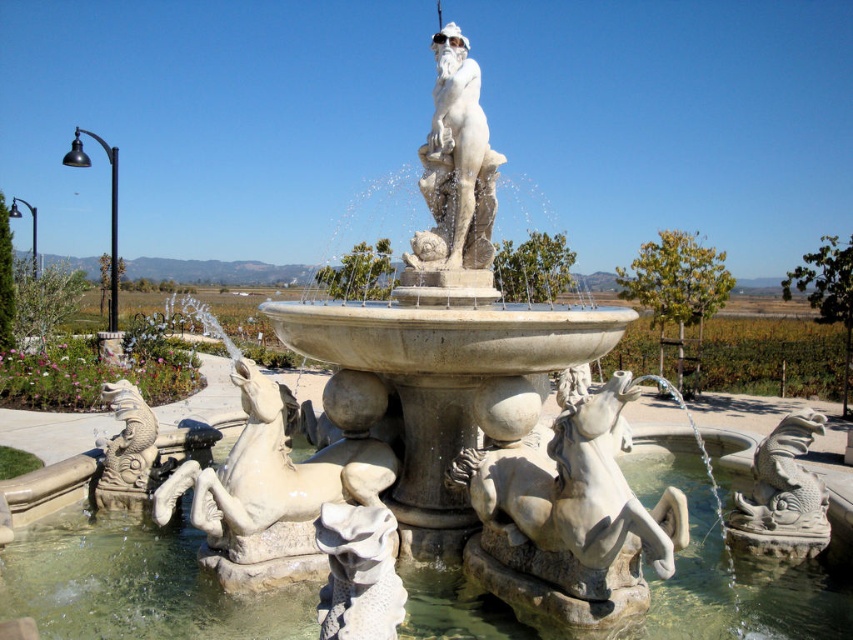
Question: Does white marble horse at lower center have a smaller size compared to gray stone dragon at lower right?

Choices:
 (A) no
 (B) yes

Answer: (A)

Question: Does white marble horse at lower center have a smaller size compared to gray stone dragon at lower right?

Choices:
 (A) no
 (B) yes

Answer: (A)

Question: Which point is farther to the camera?

Choices:
 (A) white marble horse at lower center
 (B) gray stone dragon at lower right
 (C) white marble statue at center

Answer: (C)

Question: Which of these objects is positioned closest to the gray stone dragon at lower right?

Choices:
 (A) white marble horse at center
 (B) white marble horse at lower center

Answer: (B)

Question: Among these objects, which one is nearest to the camera?

Choices:
 (A) white marble statue at center
 (B) gray stone dragon at lower right
 (C) white marble horse at center

Answer: (C)

Question: Can you confirm if white marble horse at center is positioned below white marble statue at center?

Choices:
 (A) yes
 (B) no

Answer: (A)